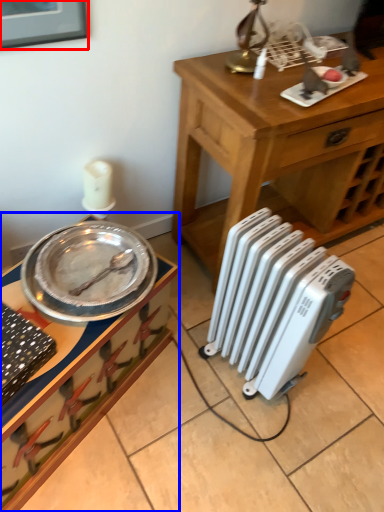
Question: Which object is closer to the camera taking this photo, picture frame (highlighted by a red box) or desk (highlighted by a blue box)?

Choices:
 (A) picture frame
 (B) desk

Answer: (A)